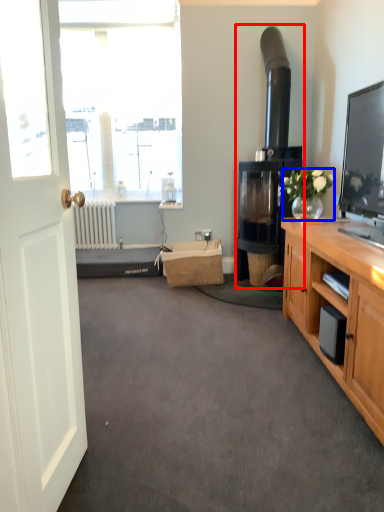
Question: Which of the following is the farthest to the observer, fireplace (highlighted by a red box) or houseplant (highlighted by a blue box)?

Choices:
 (A) fireplace
 (B) houseplant

Answer: (A)